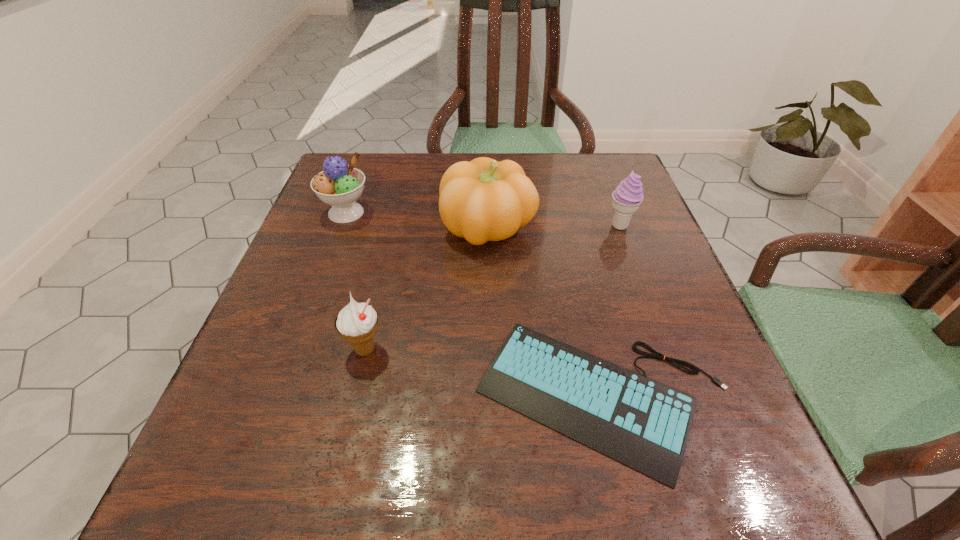
Where is `pumpkin`? The image size is (960, 540). pumpkin is located at coordinates (483, 200).

Find the location of a particular element. This screenshot has height=540, width=960. the leftmost icecream is located at coordinates (339, 185).

At what (x,y) coordinates should I click in order to perform the action: click on the rightmost icecream. Please return your answer as a coordinate pair (x, y). The image size is (960, 540). Looking at the image, I should click on [627, 197].

I want to click on the second object from left to right, so click(x=357, y=323).

The image size is (960, 540). I want to click on the nearest icecream, so click(x=357, y=323).

Find the location of a particular element. Image resolution: width=960 pixels, height=540 pixels. computer keyboard is located at coordinates (644, 424).

At what (x,y) coordinates should I click in order to perform the action: click on free space located on the left of the pumpkin. Please return your answer as a coordinate pair (x, y). This screenshot has width=960, height=540. Looking at the image, I should click on (377, 227).

Locate an element on the screen. This screenshot has width=960, height=540. vacant position located on the front of the leftmost icecream is located at coordinates (289, 367).

The image size is (960, 540). I want to click on vacant region located 0.140m on the back of the rightmost icecream, so click(x=605, y=184).

What are the coordinates of `vacant area situated on the right of the second object from left to right` in the screenshot? It's located at (597, 349).